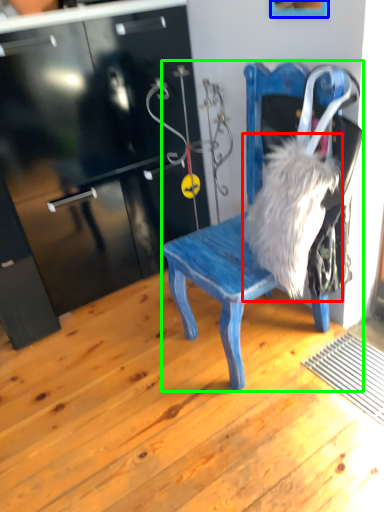
Question: Which object is positioned closest to animal (highlighted by a red box)? Select from picture frame (highlighted by a blue box) and chair (highlighted by a green box).

Choices:
 (A) picture frame
 (B) chair

Answer: (B)